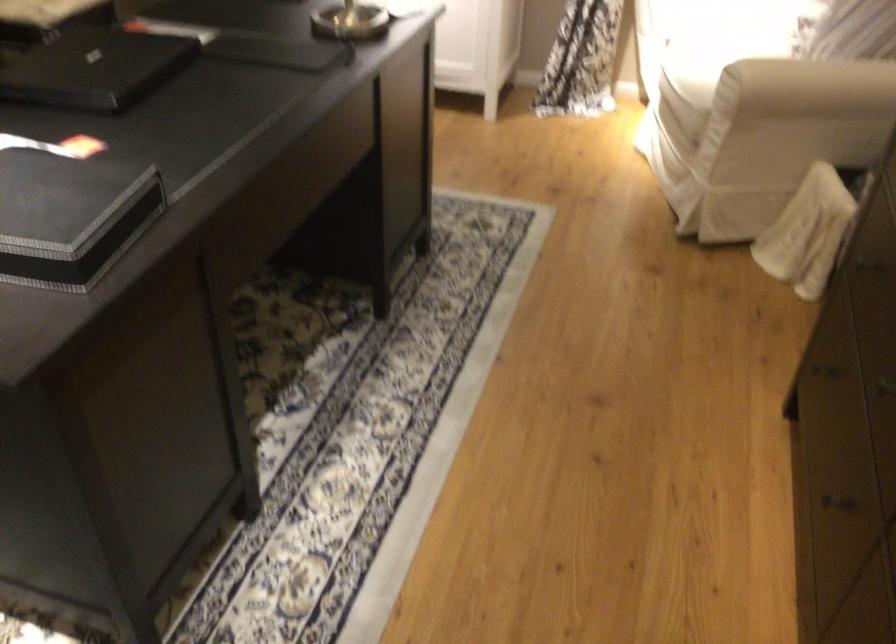
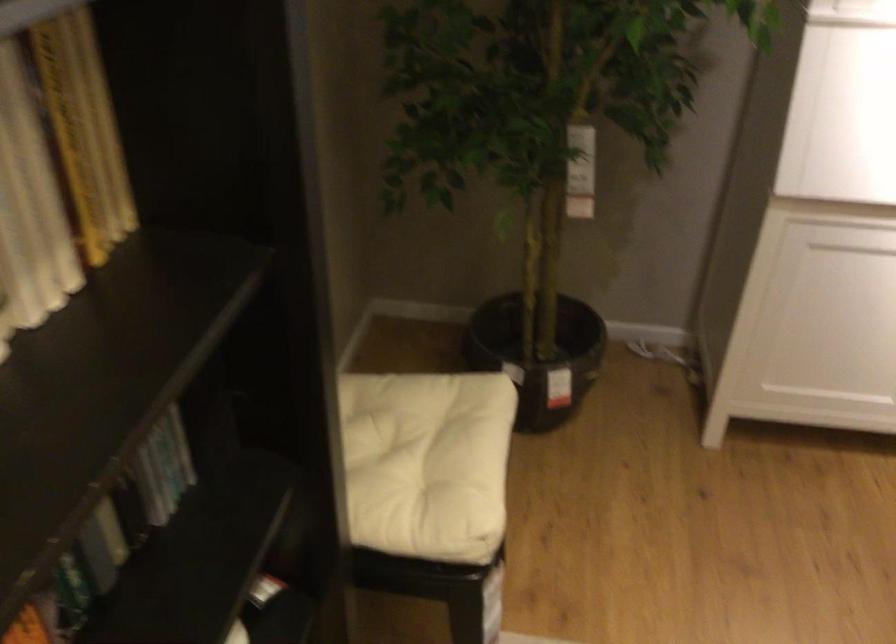
The images are taken continuously from a first-person perspective. In which direction are you moving?

Answer: The cameraman walked toward left, forward.